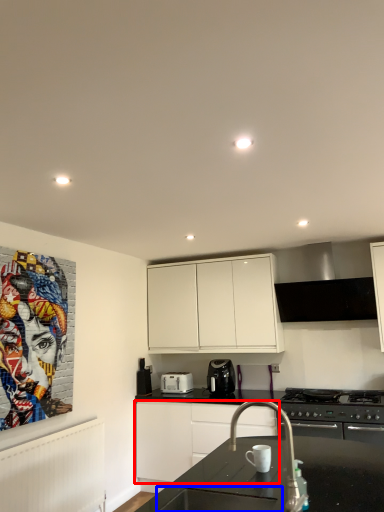
Question: Which object appears closest to the camera in this image, cabinetry (highlighted by a red box) or sink (highlighted by a blue box)?

Choices:
 (A) cabinetry
 (B) sink

Answer: (B)